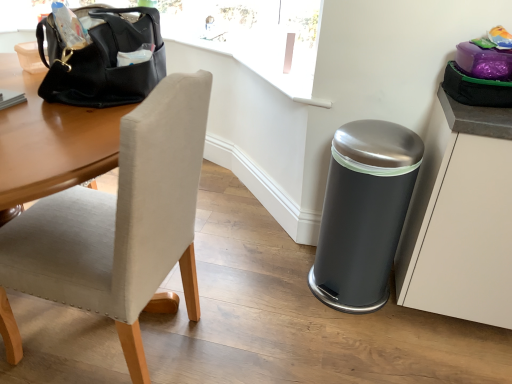
Locate an element on the screen. vacant area that lies between white matte cabinet at right and beige fabric chair at left is located at coordinates (310, 324).